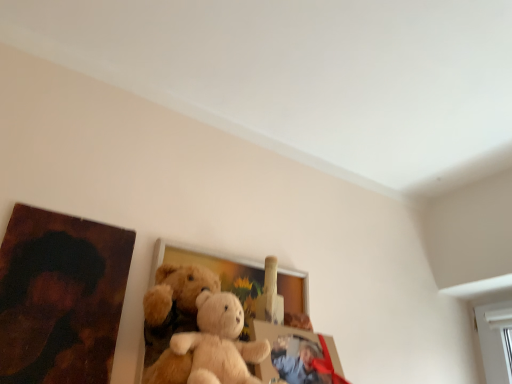
Question: Could you tell me if wooden picture frame at center, which is the 2th picture frame from left to right, is facing wooden painting at left, acting as the 1th picture frame starting from the left?

Choices:
 (A) no
 (B) yes

Answer: (A)

Question: Can you confirm if wooden picture frame at center, which is the 2th picture frame from left to right, is thinner than wooden painting at left, acting as the 1th picture frame starting from the left?

Choices:
 (A) yes
 (B) no

Answer: (B)

Question: From a real-world perspective, is wooden picture frame at center, which is the 2th picture frame in right-to-left order, on wooden painting at left, which ranks as the 3th picture frame in right-to-left order?

Choices:
 (A) no
 (B) yes

Answer: (A)

Question: Considering the relative positions of wooden picture frame at center, which is the 2th picture frame in right-to-left order, and wooden painting at left, acting as the 1th picture frame starting from the left, in the image provided, is wooden picture frame at center, which is the 2th picture frame in right-to-left order, to the right of wooden painting at left, acting as the 1th picture frame starting from the left, from the viewer's perspective?

Choices:
 (A) yes
 (B) no

Answer: (A)

Question: Would you say wooden painting at left, which ranks as the 3th picture frame in right-to-left order, is part of wooden picture frame at center, which is the 2th picture frame from left to right,'s contents?

Choices:
 (A) yes
 (B) no

Answer: (B)

Question: Based on their positions, is matte plastic picture frame at center, the 1th picture frame from the right, located to the left or right of wooden picture frame at center, which is the 2th picture frame in right-to-left order?

Choices:
 (A) left
 (B) right

Answer: (B)

Question: In terms of width, does matte plastic picture frame at center, the 1th picture frame from the right, look wider or thinner when compared to wooden picture frame at center, which is the 2th picture frame in right-to-left order?

Choices:
 (A) wide
 (B) thin

Answer: (A)

Question: Is matte plastic picture frame at center, the third picture frame viewed from the left, bigger or smaller than wooden picture frame at center, which is the 2th picture frame from left to right?

Choices:
 (A) small
 (B) big

Answer: (A)

Question: From a real-world perspective, is matte plastic picture frame at center, the 1th picture frame from the right, above or below wooden picture frame at center, which is the 2th picture frame from left to right?

Choices:
 (A) below
 (B) above

Answer: (A)

Question: From the image's perspective, is matte plastic picture frame at center, the third picture frame viewed from the left, positioned above or below wooden painting at left, which ranks as the 3th picture frame in right-to-left order?

Choices:
 (A) above
 (B) below

Answer: (B)

Question: Is matte plastic picture frame at center, the 1th picture frame from the right, in front of or behind wooden painting at left, which ranks as the 3th picture frame in right-to-left order, in the image?

Choices:
 (A) front
 (B) behind

Answer: (B)

Question: From their relative heights in the image, would you say matte plastic picture frame at center, the 1th picture frame from the right, is taller or shorter than wooden painting at left, acting as the 1th picture frame starting from the left?

Choices:
 (A) tall
 (B) short

Answer: (B)

Question: Considering the relative positions of matte plastic picture frame at center, the 1th picture frame from the right, and wooden painting at left, acting as the 1th picture frame starting from the left, in the image provided, is matte plastic picture frame at center, the 1th picture frame from the right, to the left or to the right of wooden painting at left, acting as the 1th picture frame starting from the left,?

Choices:
 (A) left
 (B) right

Answer: (B)

Question: In terms of height, does wooden picture frame at center, which is the 2th picture frame from left to right, look taller or shorter compared to wooden painting at left, which ranks as the 3th picture frame in right-to-left order?

Choices:
 (A) short
 (B) tall

Answer: (B)

Question: Looking at the image, does wooden picture frame at center, which is the 2th picture frame from left to right, seem bigger or smaller compared to wooden painting at left, acting as the 1th picture frame starting from the left?

Choices:
 (A) small
 (B) big

Answer: (B)